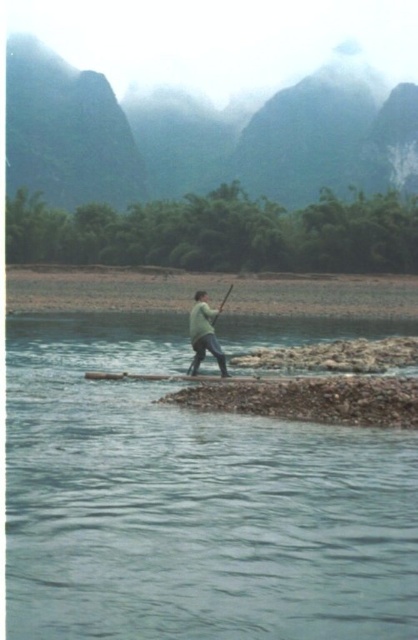
Who is positioned more to the left, clear water at center or green matte paddle at center?

clear water at center is more to the left.

Is clear water at center smaller than green matte paddle at center?

Actually, clear water at center might be larger than green matte paddle at center.

You are a GUI agent. You are given a task and a screenshot of the screen. Output one action in this format:
    pyautogui.click(x=<x>, y=<y>)
    Task: Click on the clear water at center
    Image resolution: width=418 pixels, height=640 pixels.
    Given the screenshot: What is the action you would take?
    pyautogui.click(x=191, y=502)

You are a GUI agent. You are given a task and a screenshot of the screen. Output one action in this format:
    pyautogui.click(x=<x>, y=<y>)
    Task: Click on the clear water at center
    This screenshot has height=640, width=418.
    Given the screenshot: What is the action you would take?
    pyautogui.click(x=191, y=502)